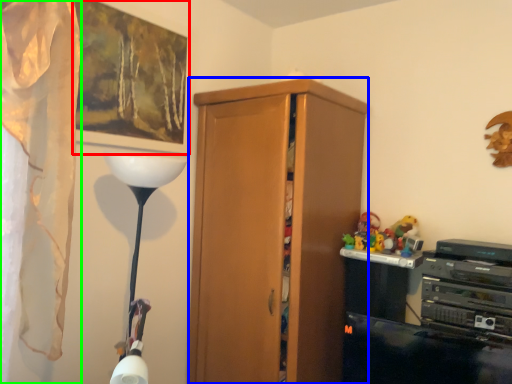
Question: Which is nearer to the picture frame (highlighted by a red box)? cabinetry (highlighted by a blue box) or curtain (highlighted by a green box).

Choices:
 (A) cabinetry
 (B) curtain

Answer: (B)